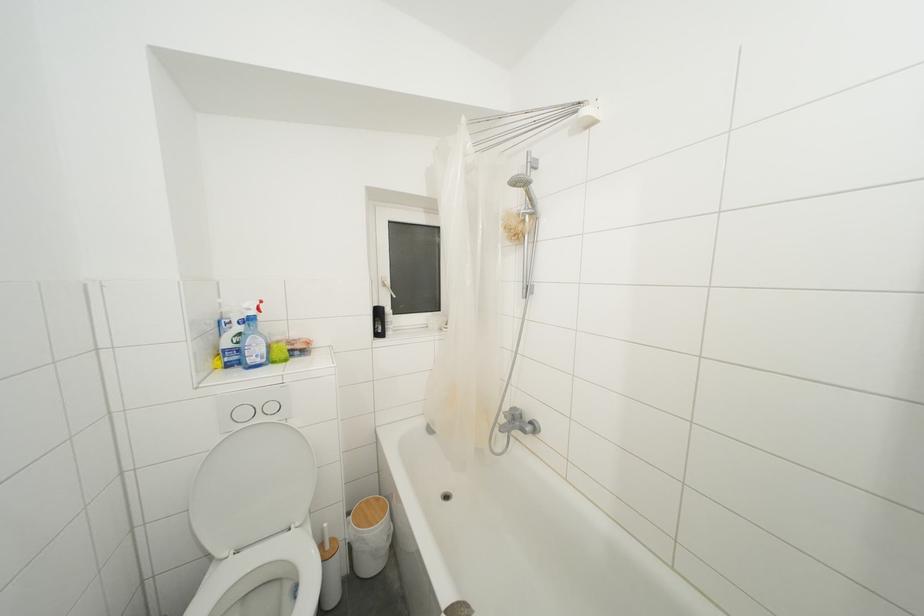
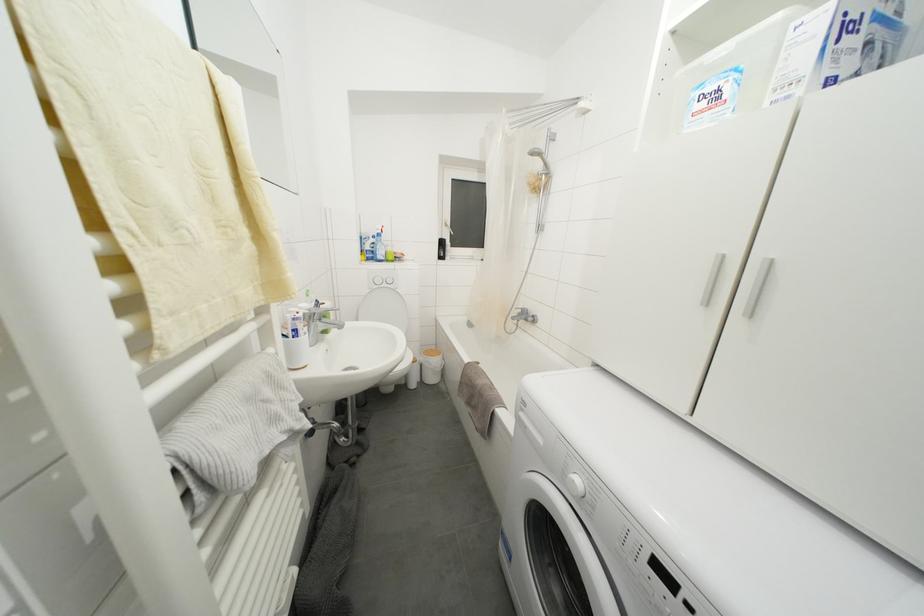
Question: What movement of the cameraman would produce the second image?

Choices:
 (A) Left
 (B) Right
 (C) Forward
 (D) Backward

Answer: (D)